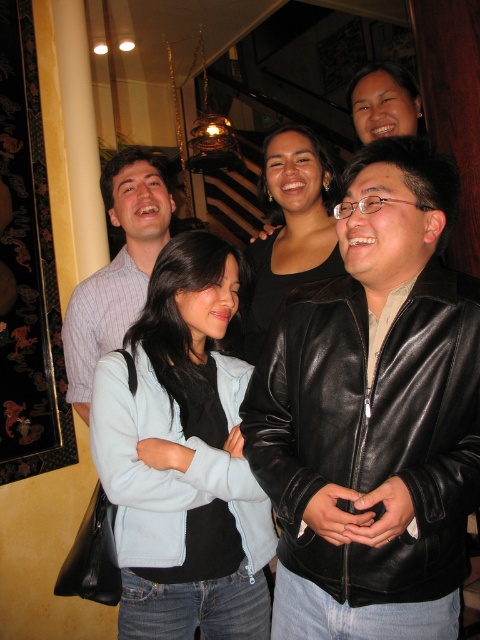
Question: Observing the image, what is the correct spatial positioning of black leather jacket at lower right in reference to light blue fabric at center?

Choices:
 (A) left
 (B) right

Answer: (B)

Question: Which point is farther to the camera?

Choices:
 (A) light blue fabric at center
 (B) black leather jacket at center
 (C) black leather jacket at lower right

Answer: (A)

Question: Can you confirm if black leather jacket at lower right is smaller than black leather jacket at center?

Choices:
 (A) no
 (B) yes

Answer: (B)

Question: Which point is farther to the camera?

Choices:
 (A) black leather jacket at center
 (B) light blue fabric at center
 (C) striped cotton shirt at left

Answer: (C)

Question: Among these objects, which one is nearest to the camera?

Choices:
 (A) light blue fabric at center
 (B) striped cotton shirt at left
 (C) black leather jacket at center

Answer: (C)

Question: Where is black leather jacket at lower right located in relation to light blue fabric at center in the image?

Choices:
 (A) right
 (B) left

Answer: (A)